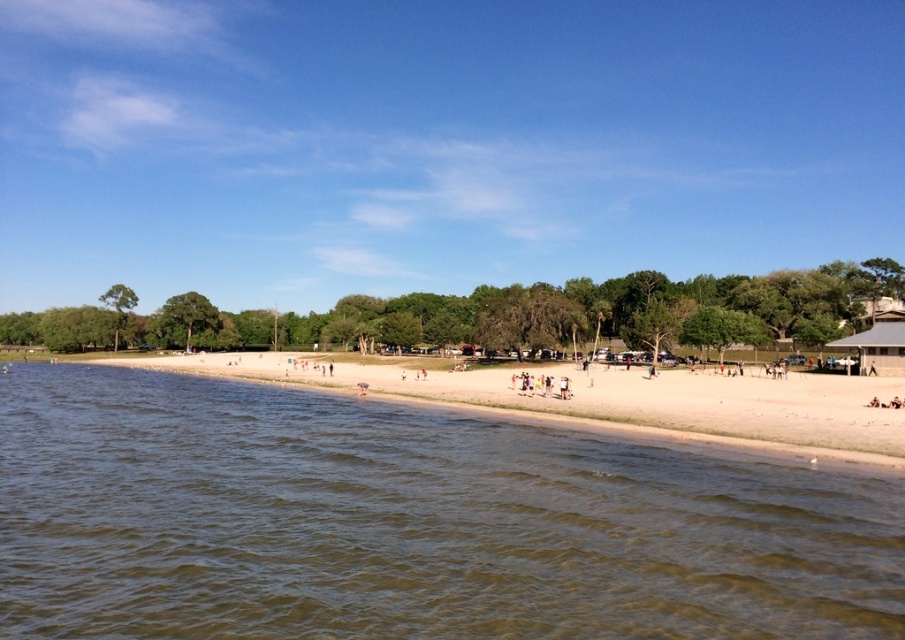
What do you see at coordinates (411, 522) in the screenshot? I see `brown water at lower left` at bounding box center [411, 522].

Is point (91, 412) farther from camera compared to point (262, 372)?

No.

Locate an element on the screen. brown water at lower left is located at coordinates (411, 522).

Find the location of `brown water at lower left`. brown water at lower left is located at coordinates coord(411,522).